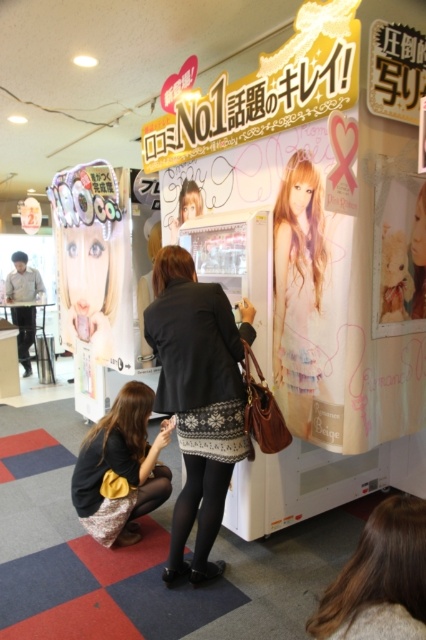
You are standing in front of the claw machine and want to reach two points on the machine. The first point is at coordinates point (180, 381) and the second point is at point (396, 572). Which point is closer to you?

Point (180, 381) is closer to you because it is further to the viewer than point (396, 572).

You are a fashion designer observing the scene at the claw machine. You notice the black textured sweater at center and the blonde hair at lower center. Which object has a greater width in the image?

The black textured sweater at center has a greater width than the blonde hair at lower center.

Consider the image. You are standing in front of the claw machine and notice the blonde hair at lower center. Where exactly is the blonde hair located in relation to the claw machine?

The blonde hair at lower center is located at point (379,579) relative to the claw machine.